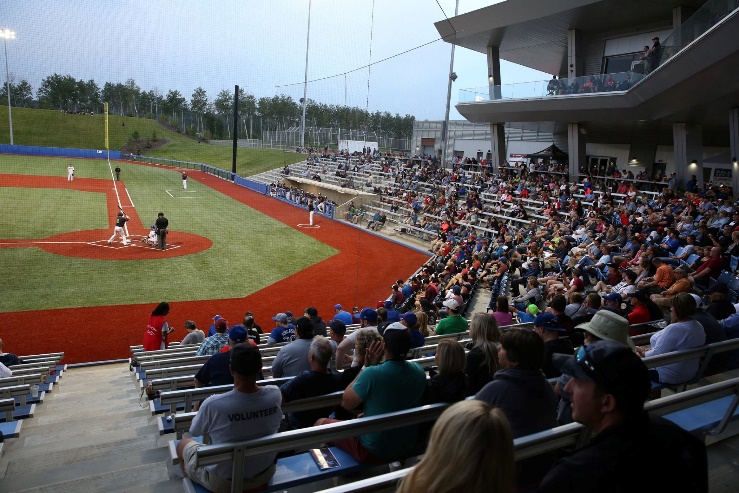
You are a GUI agent. You are given a task and a screenshot of the screen. Output one action in this format:
    pyautogui.click(x=<x>, y=<y>)
    Task: Click on the fans
    
    Given the screenshot: What is the action you would take?
    (x=525, y=253)